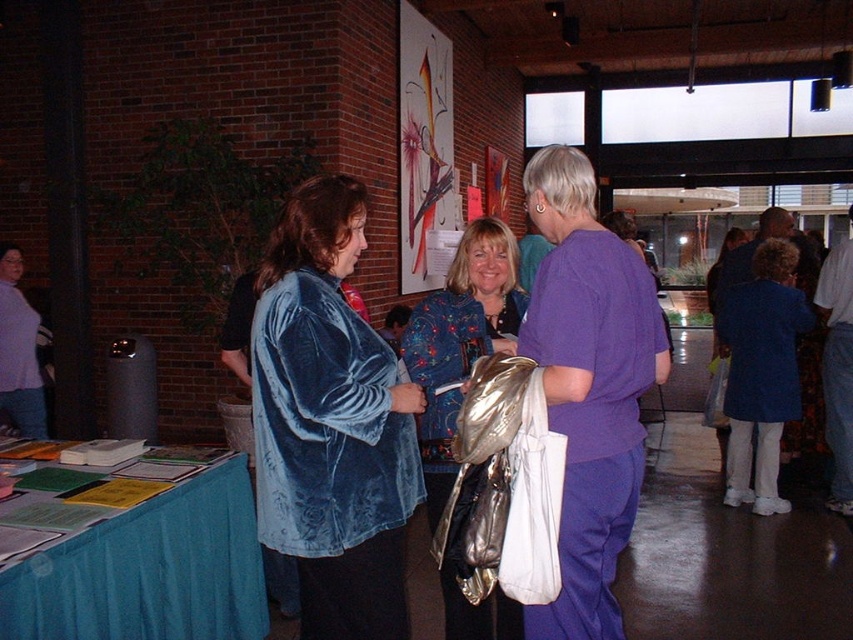
You are standing in the modern building and want to find the exact location of the point marked at coordinates (331, 422). According to the scene, where is this point located?

The point at coordinates (331, 422) is located on the velvet blue jacket at center.

You are organizing a photo shoot and need to ensure that the velvet blue jacket at center and the teal fabric table at lower left are both visible in the frame. Given that the camera has a fixed width, which object should you prioritize positioning closer to the camera to ensure both fit without cropping?

Since the velvet blue jacket at center is wider than the teal fabric table at lower left, you should prioritize positioning the velvet blue jacket at center closer to the camera to ensure both fit without cropping.